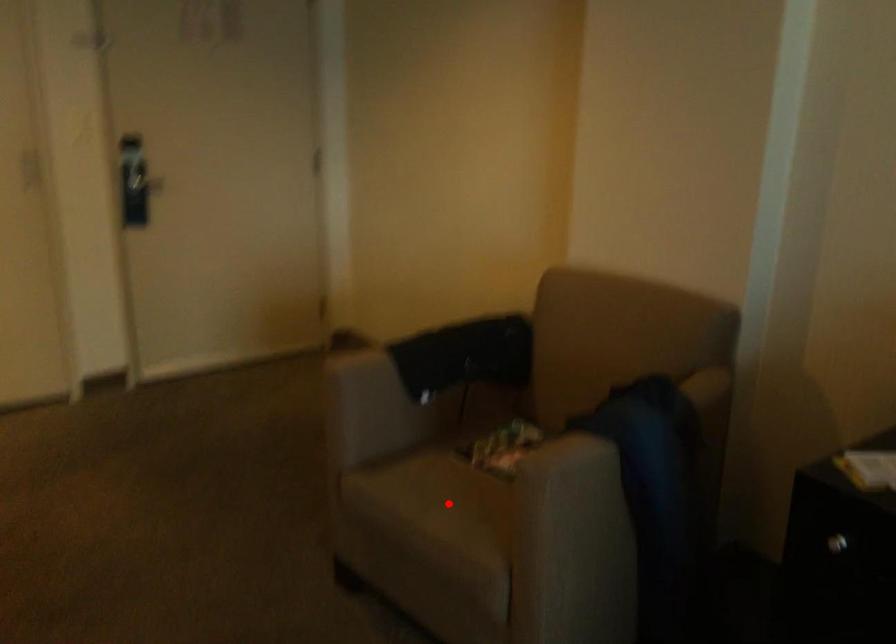
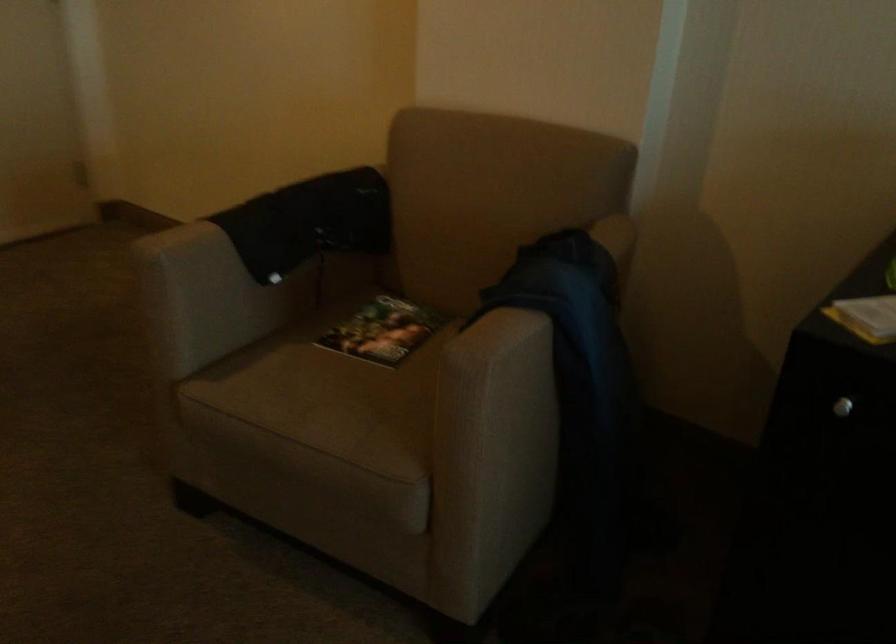
Question: I am providing you with two images of the same scene from different viewpoints. Given a red point in image1, look at the same physical point in image2. Is it:

Choices:
 (A) Closer to the viewpoint
 (B) Farther from the viewpoint

Answer: (A)